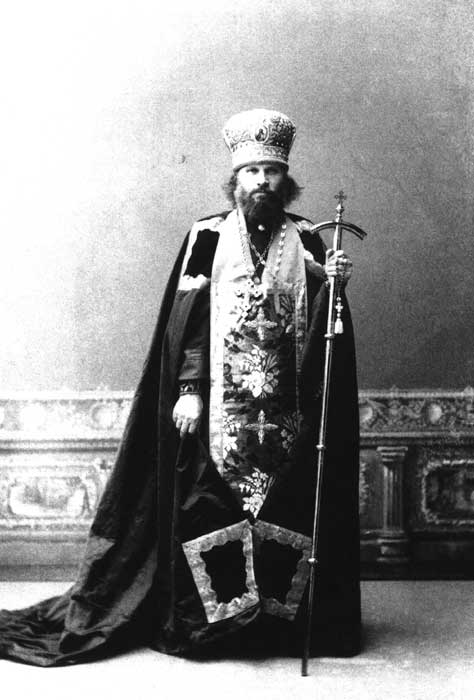
Where is `wall`? wall is located at coordinates (41, 348).